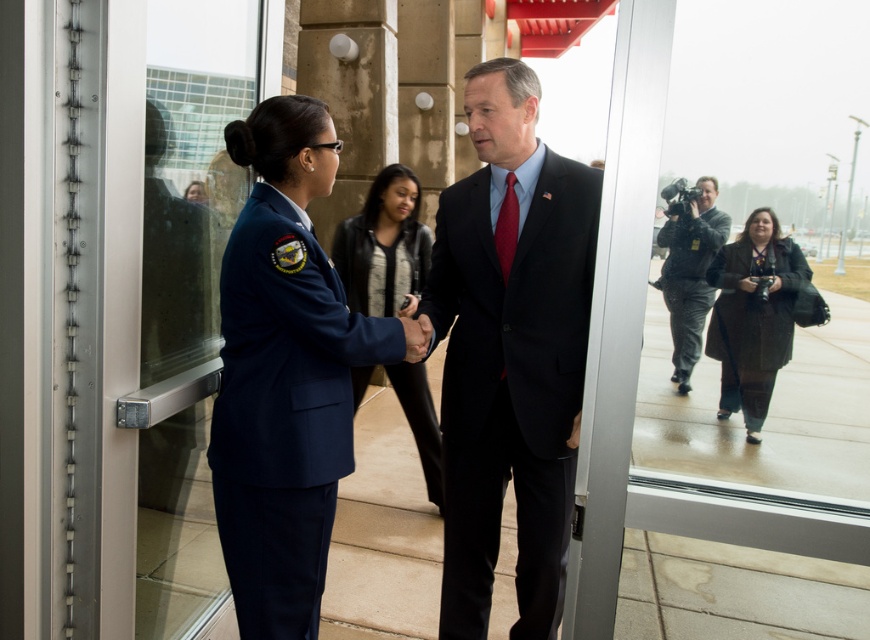
Between point (439, 324) and point (419, 289), which one is positioned in front?

Point (439, 324) is more forward.

The image size is (870, 640). Describe the element at coordinates (510, 352) in the screenshot. I see `dark blue suit at center` at that location.

What do you see at coordinates (510, 352) in the screenshot? This screenshot has height=640, width=870. I see `dark blue suit at center` at bounding box center [510, 352].

This screenshot has height=640, width=870. Find the location of `dark blue suit at center`. dark blue suit at center is located at coordinates (510, 352).

Does transparent glass door at left have a lesser height compared to navy blue uniform at center?

Incorrect, transparent glass door at left's height does not fall short of navy blue uniform at center's.

Does transparent glass door at left come behind navy blue uniform at center?

That is False.

Is point (99, 621) more distant than point (232, 328)?

No, it is not.

Locate an element on the screen. This screenshot has width=870, height=640. transparent glass door at left is located at coordinates (169, 296).

Looking at this image, between black leather jacket at center and dark brown textured coat at lower right, which one is positioned higher?

black leather jacket at center is higher up.

Does black leather jacket at center come behind dark brown textured coat at lower right?

Yes, it is.

This screenshot has height=640, width=870. What do you see at coordinates (383, 244) in the screenshot?
I see `black leather jacket at center` at bounding box center [383, 244].

You are a GUI agent. You are given a task and a screenshot of the screen. Output one action in this format:
    pyautogui.click(x=<x>, y=<y>)
    Task: Click on the black leather jacket at center
    The height and width of the screenshot is (640, 870).
    Given the screenshot: What is the action you would take?
    pyautogui.click(x=383, y=244)